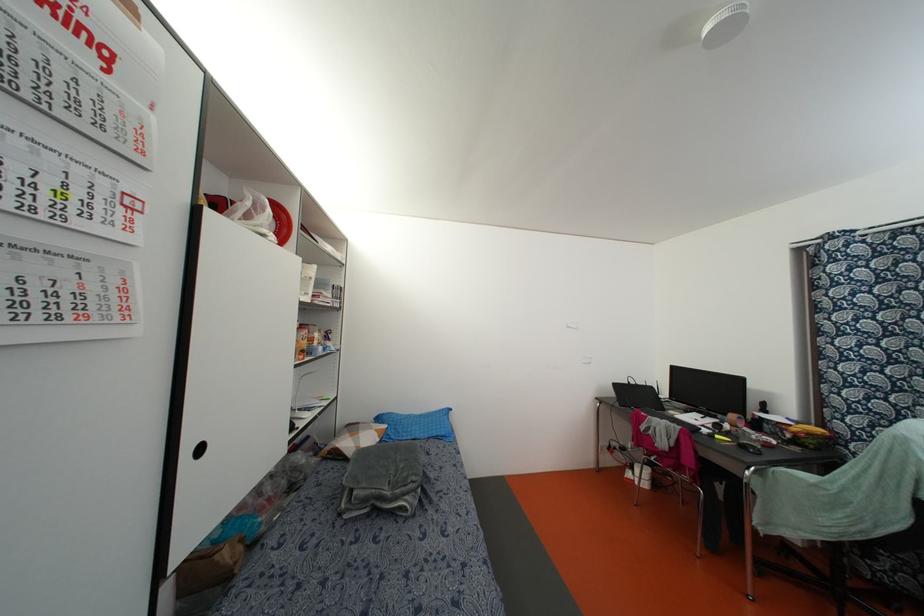
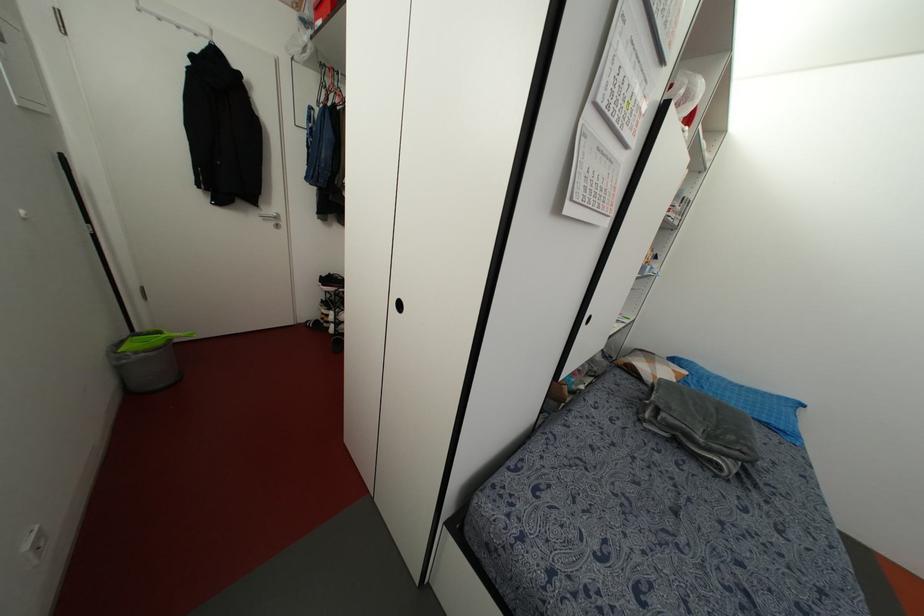
First-person continuous shooting, in which direction is the camera rotating?

The camera rotated toward left-down.